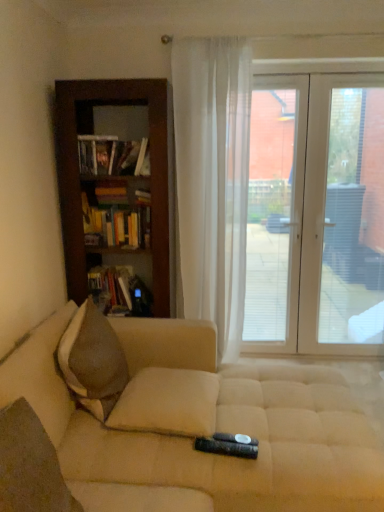
Find the location of `vacant space situated above transparent glass door at right, which is the first window screen from right to left (from a real-world perspective)`. vacant space situated above transparent glass door at right, which is the first window screen from right to left (from a real-world perspective) is located at coordinates (358, 78).